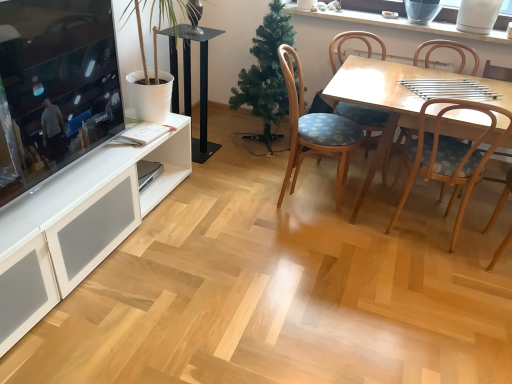
Locate an element on the screen. Image resolution: width=512 pixels, height=384 pixels. vacant region to the right of black glass speaker at center is located at coordinates (225, 158).